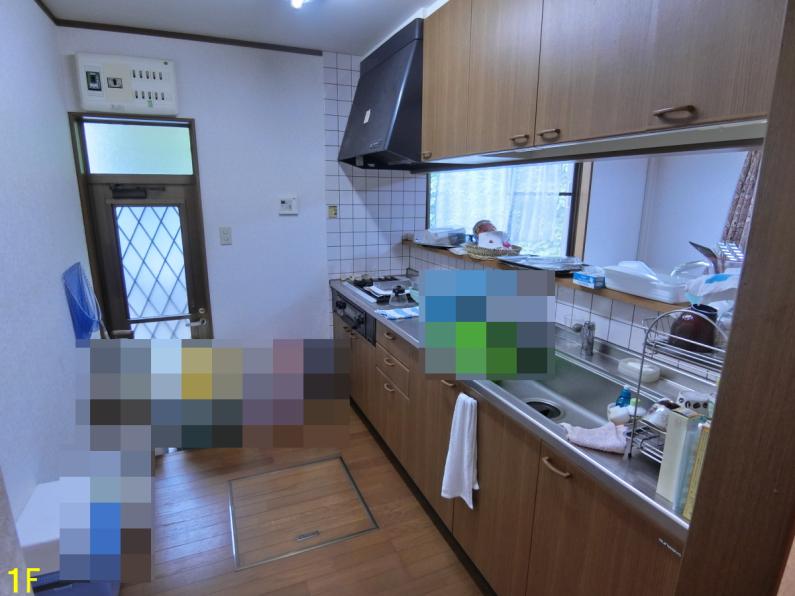
The width and height of the screenshot is (795, 596). I want to click on cups, so click(x=653, y=420), click(x=696, y=393).